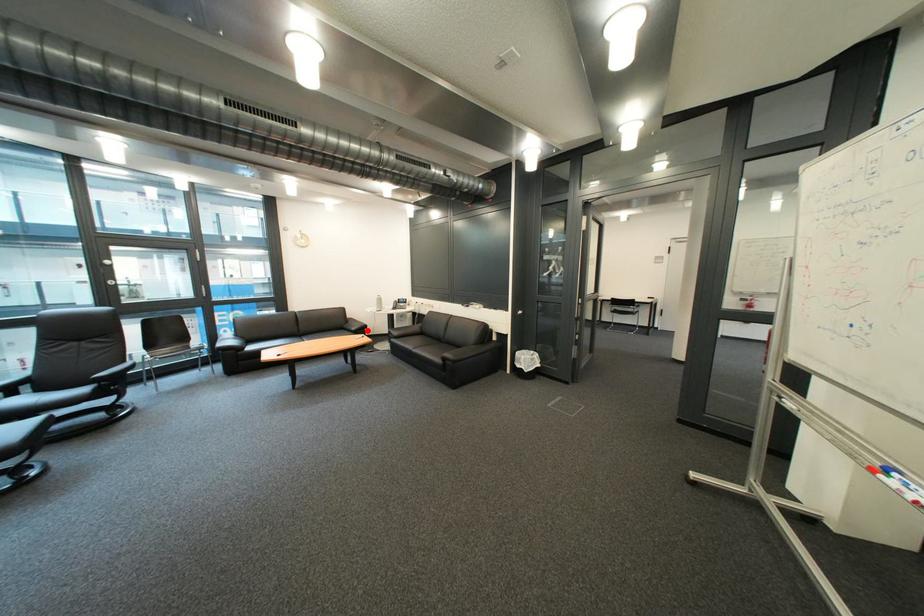
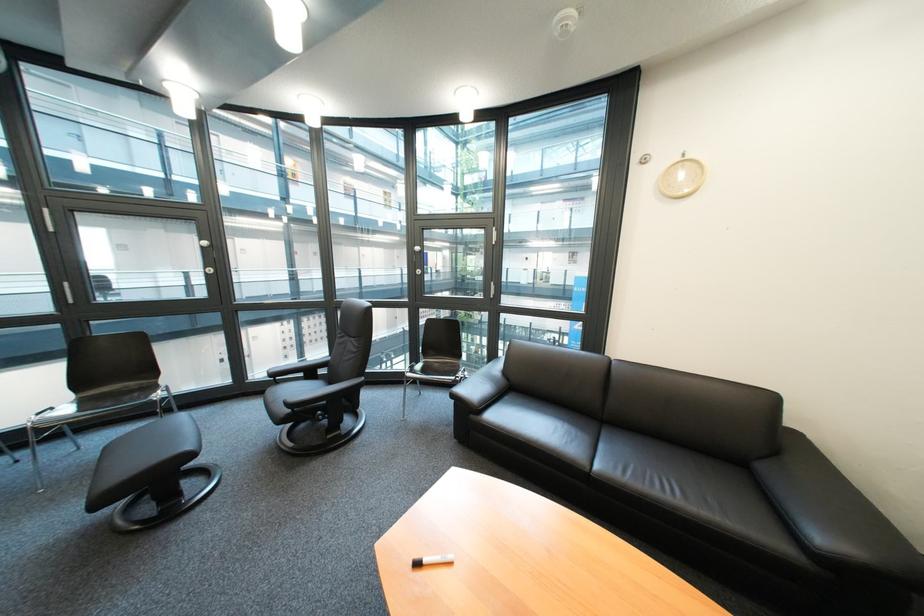
The point at the highlighted location is marked in the first image. Where is the corresponding point in the second image?

(833, 540)